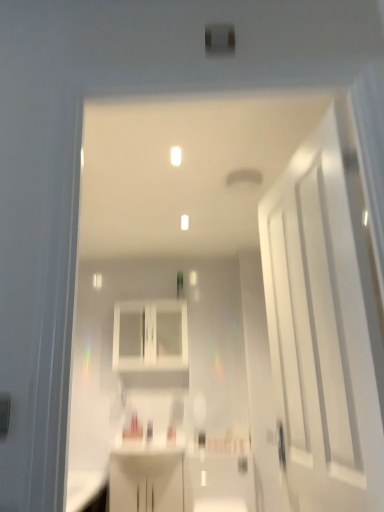
Find the location of a particular element. The width and height of the screenshot is (384, 512). white glossy door at right is located at coordinates [x=325, y=324].

What is the approximate width of white glossy door at right?

The width of white glossy door at right is 6.48 inches.

What do you see at coordinates (325, 324) in the screenshot? The height and width of the screenshot is (512, 384). I see `white glossy door at right` at bounding box center [325, 324].

What do you see at coordinates (150, 336) in the screenshot? I see `white glossy cabinet at center` at bounding box center [150, 336].

The height and width of the screenshot is (512, 384). Find the location of `white glossy cabinet at center`. white glossy cabinet at center is located at coordinates (150, 336).

This screenshot has width=384, height=512. I want to click on white glossy door at right, so click(325, 324).

Which is more to the right, white glossy door at right or white glossy cabinet at center?

white glossy door at right.

Which object is closer to the camera taking this photo, white glossy door at right or white glossy cabinet at center?

white glossy door at right.

Does point (306, 377) lie behind point (154, 319)?

No.

From the image's perspective, is white glossy door at right on top of white glossy cabinet at center?

Yes, from the image's perspective, white glossy door at right is over white glossy cabinet at center.

From a real-world perspective, is white glossy door at right positioned above or below white glossy cabinet at center?

Clearly, from a real-world perspective, white glossy door at right is below white glossy cabinet at center.

Is white glossy door at right thinner than white glossy cabinet at center?

Yes, white glossy door at right is thinner than white glossy cabinet at center.

Considering the sizes of white glossy door at right and white glossy cabinet at center in the image, is white glossy door at right taller or shorter than white glossy cabinet at center?

In the image, white glossy door at right appears to be taller than white glossy cabinet at center.

Is white glossy door at right smaller than white glossy cabinet at center?

No.

Is white glossy cabinet at center completely or partially inside white glossy door at right?

Actually, white glossy cabinet at center is outside white glossy door at right.

Is white glossy door at right far away from white glossy cabinet at center?

Absolutely, white glossy door at right is distant from white glossy cabinet at center.

Is white glossy door at right aimed at white glossy cabinet at center?

No, white glossy door at right does not turn towards white glossy cabinet at center.

Can you tell me how much white glossy door at right and white glossy cabinet at center differ in facing direction?

79 degrees.

Find the location of a particular element. Image resolution: width=384 pixels, height=512 pixels. door that appears in front of the white glossy cabinet at center is located at coordinates tap(325, 324).

Considering the relative positions of white glossy cabinet at center and white glossy door at right in the image provided, is white glossy cabinet at center to the left or to the right of white glossy door at right?

From the image, it's evident that white glossy cabinet at center is to the left of white glossy door at right.

Consider the image. Considering the positions of objects white glossy cabinet at center and white glossy door at right in the image provided, who is behind, white glossy cabinet at center or white glossy door at right?

white glossy cabinet at center is further away from the camera.

Is point (152, 343) farther from viewer compared to point (286, 175)?

Yes, point (152, 343) is farther from viewer.

From the image's perspective, would you say white glossy cabinet at center is shown under white glossy door at right?

Indeed, from the image's perspective, white glossy cabinet at center is shown beneath white glossy door at right.

From a real-world perspective, is white glossy cabinet at center physically located above or below white glossy door at right?

white glossy cabinet at center is situated higher than white glossy door at right in the real world.

Which object is wider, white glossy cabinet at center or white glossy door at right?

white glossy cabinet at center is wider.

Between white glossy cabinet at center and white glossy door at right, which one has less height?

white glossy cabinet at center is shorter.

Based on their sizes in the image, would you say white glossy cabinet at center is bigger or smaller than white glossy door at right?

Clearly, white glossy cabinet at center is smaller in size than white glossy door at right.

Does white glossy cabinet at center contain white glossy door at right?

No, white glossy cabinet at center does not contain white glossy door at right.

Is there a large distance between white glossy cabinet at center and white glossy door at right?

white glossy cabinet at center is positioned a significant distance from white glossy door at right.

Could you tell me if white glossy cabinet at center is facing white glossy door at right?

Yes, white glossy cabinet at center is oriented towards white glossy door at right.

Locate an element on the screen. The image size is (384, 512). cabinetry that appears below the white glossy door at right (from the image's perspective) is located at coordinates (150, 336).

At what (x,y) coordinates should I click in order to perform the action: click on cabinetry on the left of white glossy door at right. Please return your answer as a coordinate pair (x, y). The image size is (384, 512). Looking at the image, I should click on (150, 336).

Locate an element on the screen. Image resolution: width=384 pixels, height=512 pixels. door located in front of the white glossy cabinet at center is located at coordinates (325, 324).